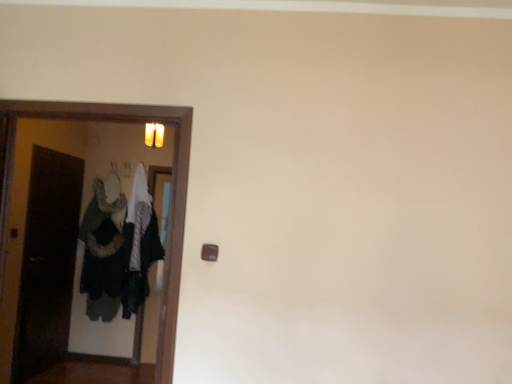
Measure the distance between point (137, 167) and camera.

The distance of point (137, 167) from camera is 4.46 meters.

What is the approximate width of dark gray fuzzy coat at left?

The width of dark gray fuzzy coat at left is 12.39 inches.

This screenshot has width=512, height=384. Describe the element at coordinates (139, 245) in the screenshot. I see `dark gray fuzzy coat at left` at that location.

The width and height of the screenshot is (512, 384). I want to click on dark gray fuzzy coat at left, so click(x=139, y=245).

Based on the photo, measure the distance between dark gray fuzzy coat at left and camera.

A distance of 4.24 meters exists between dark gray fuzzy coat at left and camera.

Describe the element at coordinates (173, 192) in the screenshot. I see `wooden door at left` at that location.

This screenshot has height=384, width=512. I want to click on wooden door at left, so click(173, 192).

This screenshot has height=384, width=512. What are the coordinates of `dark gray fuzzy coat at left` in the screenshot? It's located at (139, 245).

Visually, is wooden door at left positioned to the left or to the right of dark gray fuzzy coat at left?

In the image, wooden door at left appears on the right side of dark gray fuzzy coat at left.

Does wooden door at left lie in front of dark gray fuzzy coat at left?

Yes, it is in front of dark gray fuzzy coat at left.

Which is more distant, (174, 180) or (136, 278)?

The point (136, 278) is behind.

From the image's perspective, which one is positioned higher, wooden door at left or dark gray fuzzy coat at left?

wooden door at left, from the image's perspective.

From a real-world perspective, does wooden door at left stand above dark gray fuzzy coat at left?

Indeed, from a real-world perspective, wooden door at left stands above dark gray fuzzy coat at left.

Looking at their sizes, would you say wooden door at left is wider or thinner than dark gray fuzzy coat at left?

Considering their sizes, wooden door at left looks slimmer than dark gray fuzzy coat at left.

Between wooden door at left and dark gray fuzzy coat at left, which one has less height?

With less height is wooden door at left.

Who is smaller, wooden door at left or dark gray fuzzy coat at left?

wooden door at left.

Is wooden door at left not within dark gray fuzzy coat at left?

wooden door at left lies outside dark gray fuzzy coat at left's area.

Are wooden door at left and dark gray fuzzy coat at left beside each other?

wooden door at left and dark gray fuzzy coat at left are clearly separated.

Does wooden door at left turn towards dark gray fuzzy coat at left?

No, wooden door at left is not facing towards dark gray fuzzy coat at left.

Can you tell me how much wooden door at left and dark gray fuzzy coat at left differ in facing direction?

There is a 0.242-degree angle between the facing directions of wooden door at left and dark gray fuzzy coat at left.

Locate an element on the screen. door above the dark gray fuzzy coat at left (from a real-world perspective) is located at coordinates (173, 192).

Considering the relative positions of dark gray fuzzy coat at left and wooden door at left in the image provided, is dark gray fuzzy coat at left to the left of wooden door at left from the viewer's perspective?

Correct, you'll find dark gray fuzzy coat at left to the left of wooden door at left.

Considering the relative positions of dark gray fuzzy coat at left and wooden door at left in the image provided, is dark gray fuzzy coat at left behind wooden door at left?

Yes, dark gray fuzzy coat at left is further from the viewer.

Is point (129, 289) closer or farther from the camera than point (158, 355)?

Point (129, 289) appears to be farther away from the viewer than point (158, 355).

From the image's perspective, is dark gray fuzzy coat at left on top of wooden door at left?

Incorrect, from the image's perspective, dark gray fuzzy coat at left is lower than wooden door at left.

From a real-world perspective, between dark gray fuzzy coat at left and wooden door at left, who is vertically lower?

dark gray fuzzy coat at left, from a real-world perspective.

Considering the sizes of objects dark gray fuzzy coat at left and wooden door at left in the image provided, who is thinner, dark gray fuzzy coat at left or wooden door at left?

Thinner between the two is wooden door at left.

From their relative heights in the image, would you say dark gray fuzzy coat at left is taller or shorter than wooden door at left?

Clearly, dark gray fuzzy coat at left is taller compared to wooden door at left.

Can you confirm if dark gray fuzzy coat at left is smaller than wooden door at left?

No, dark gray fuzzy coat at left is not smaller than wooden door at left.

Is wooden door at left located within dark gray fuzzy coat at left?

No, wooden door at left is not a part of dark gray fuzzy coat at left.

Is the surface of dark gray fuzzy coat at left in direct contact with wooden door at left?

dark gray fuzzy coat at left and wooden door at left are clearly separated.

Is dark gray fuzzy coat at left turned away from wooden door at left?

No, dark gray fuzzy coat at left is not facing the opposite direction of wooden door at left.

How different are the orientations of dark gray fuzzy coat at left and wooden door at left in degrees?

They differ by 0.242 degrees in their facing directions.

Locate an element on the screen. The width and height of the screenshot is (512, 384). clothing that is on the left side of wooden door at left is located at coordinates (139, 245).

Locate an element on the screen. Image resolution: width=512 pixels, height=384 pixels. door on the right of the dark gray fuzzy coat at left is located at coordinates (173, 192).

Where is `door that appears above the dark gray fuzzy coat at left (from a real-world perspective)`? door that appears above the dark gray fuzzy coat at left (from a real-world perspective) is located at coordinates (173, 192).